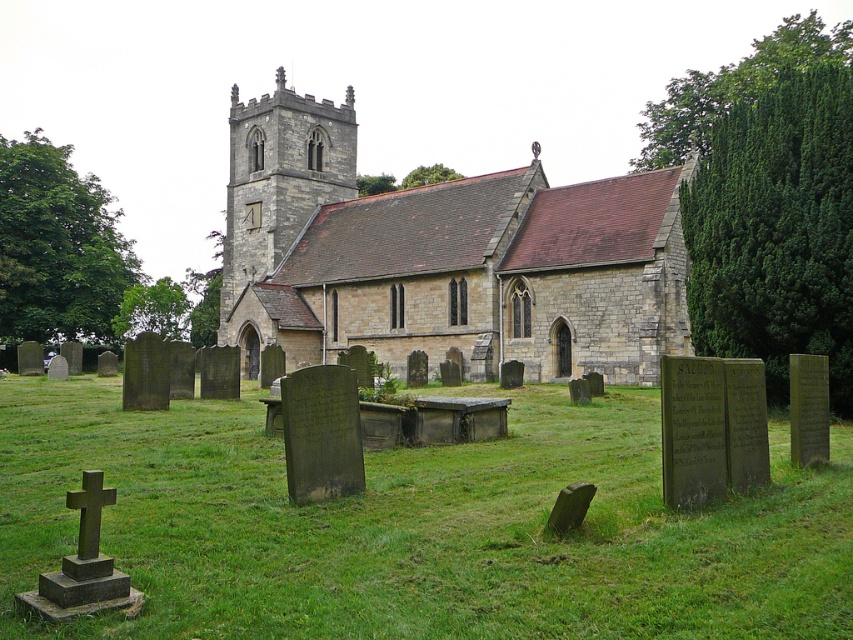
Question: Which point is closer to the camera?

Choices:
 (A) stone church at center
 (B) green grass at center

Answer: (B)

Question: Can you confirm if green grass at center is positioned to the right of stone church at center?

Choices:
 (A) no
 (B) yes

Answer: (A)

Question: Among these objects, which one is farthest from the camera?

Choices:
 (A) green grass at center
 (B) stone church at center

Answer: (B)

Question: Which point is closer to the camera taking this photo?

Choices:
 (A) (718, 509)
 (B) (300, 138)

Answer: (A)

Question: Can you confirm if green grass at center is positioned below stone church at center?

Choices:
 (A) yes
 (B) no

Answer: (A)

Question: Is green grass at center above stone church at center?

Choices:
 (A) no
 (B) yes

Answer: (A)